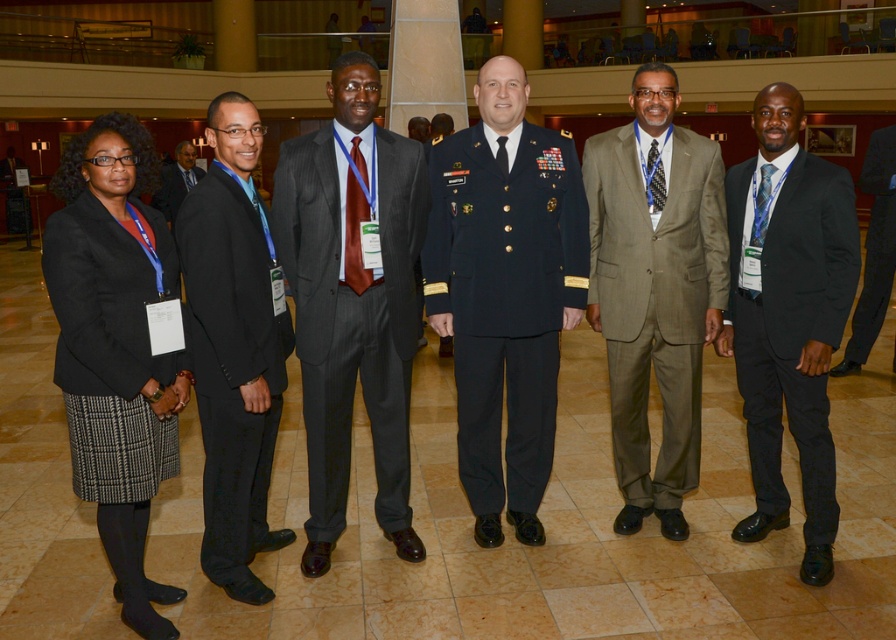
Question: Estimate the real-world distances between objects in this image. Which object is farther from the black smooth suit at right?

Choices:
 (A) black suit at left
 (B) black satin suit at right
 (C) matte black suit at left
 (D) navy blue uniform at center

Answer: (C)

Question: Is matte black blazer at left bigger than black smooth suit at right?

Choices:
 (A) yes
 (B) no

Answer: (B)

Question: Which object is the closest to the khaki wool suit at center?

Choices:
 (A) navy blue uniform at center
 (B) black satin suit at right
 (C) dark gray pinstripe suit at center
 (D) black smooth suit at right

Answer: (B)

Question: Which point is closer to the camera?

Choices:
 (A) black suit at left
 (B) black satin suit at right
 (C) navy blue uniform at center
 (D) matte black suit at left

Answer: (A)

Question: Observing the image, what is the correct spatial positioning of black satin suit at right in reference to matte black suit at left?

Choices:
 (A) below
 (B) above

Answer: (A)

Question: Can you confirm if matte black blazer at left is positioned to the right of black suit at left?

Choices:
 (A) no
 (B) yes

Answer: (A)